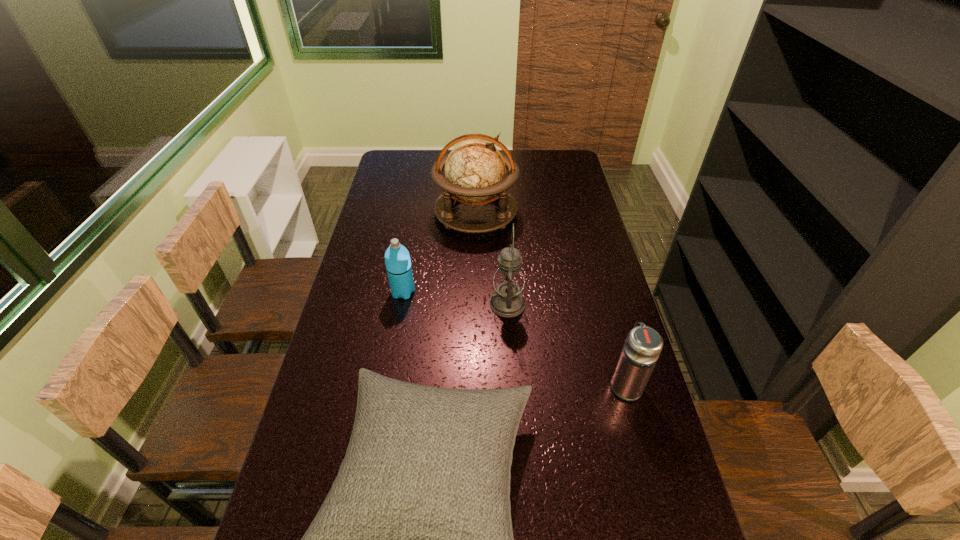
The height and width of the screenshot is (540, 960). Find the location of `vacant space located 0.100m on the front of the left thermos bottle`. vacant space located 0.100m on the front of the left thermos bottle is located at coordinates (397, 325).

Where is `object present at the left edge`? The width and height of the screenshot is (960, 540). object present at the left edge is located at coordinates (397, 259).

Where is `object located at the right edge`? The image size is (960, 540). object located at the right edge is located at coordinates (643, 345).

The image size is (960, 540). In order to click on free space at the left edge of the desktop in this screenshot , I will do `click(388, 245)`.

What are the coordinates of `vacant region at the right edge of the desktop` in the screenshot? It's located at (682, 529).

Where is `vacant space that is in between the rightmost object and the oil lamp`? The width and height of the screenshot is (960, 540). vacant space that is in between the rightmost object and the oil lamp is located at coordinates (566, 345).

Locate an element on the screen. The height and width of the screenshot is (540, 960). blank region between the rightmost object and the farthest object is located at coordinates (550, 299).

This screenshot has height=540, width=960. Identify the location of free space between the rightmost object and the oil lamp. point(566,345).

The height and width of the screenshot is (540, 960). Identify the location of unoccupied position between the oil lamp and the right thermos bottle. (566, 345).

Identify the location of empty space that is in between the left thermos bottle and the oil lamp. The width and height of the screenshot is (960, 540). (455, 298).